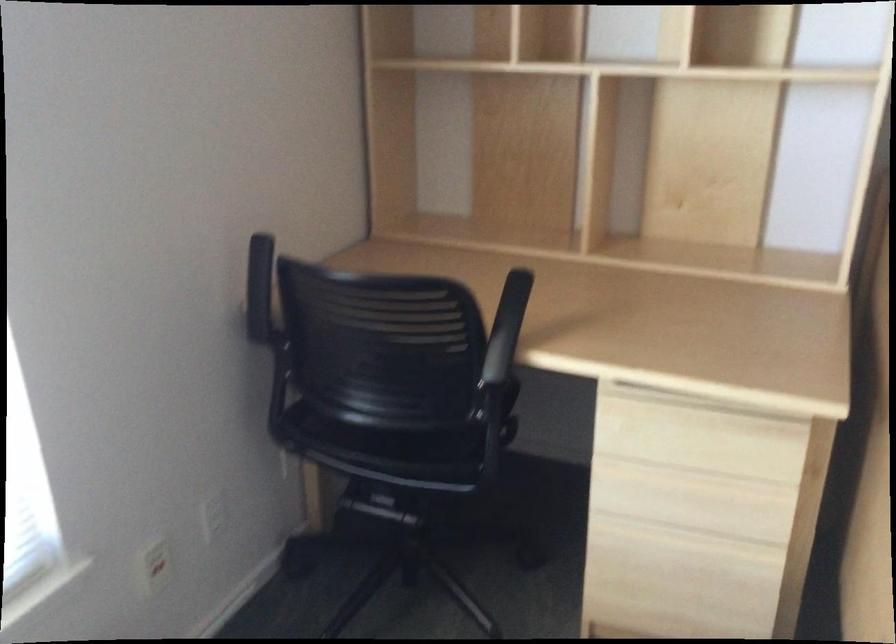
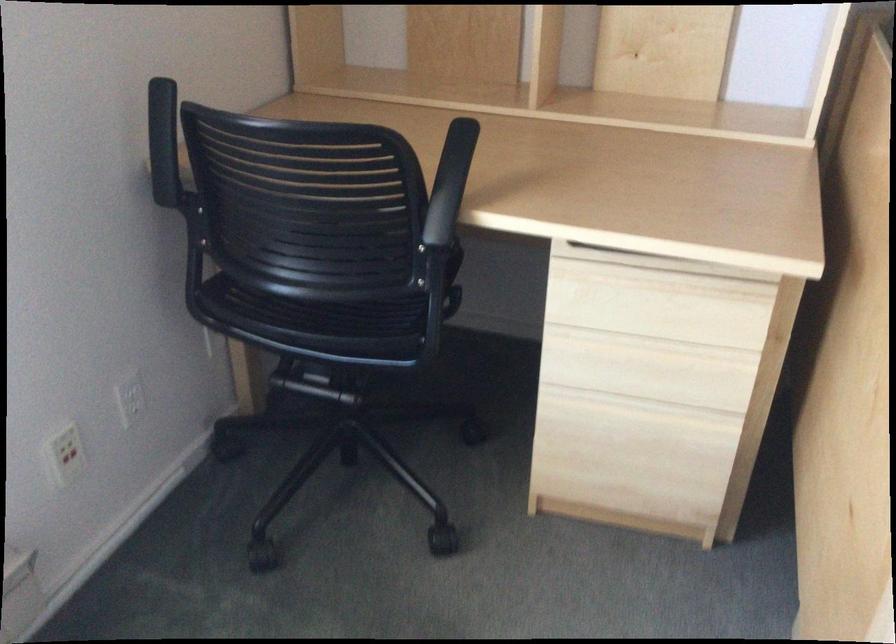
Find the pixel in the second image that matches (x=259, y=241) in the first image.

(162, 88)